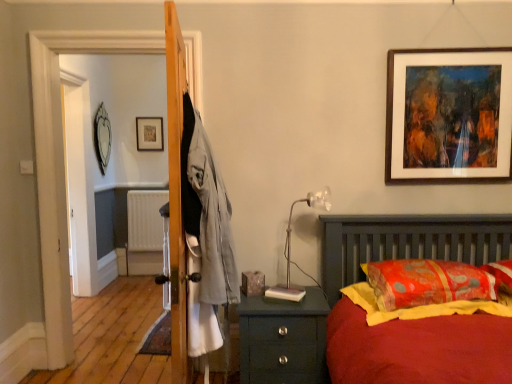
Locate an element on the screen. The height and width of the screenshot is (384, 512). blank space situated above teal wooden nightstand at lower right (from a real-world perspective) is located at coordinates (288, 296).